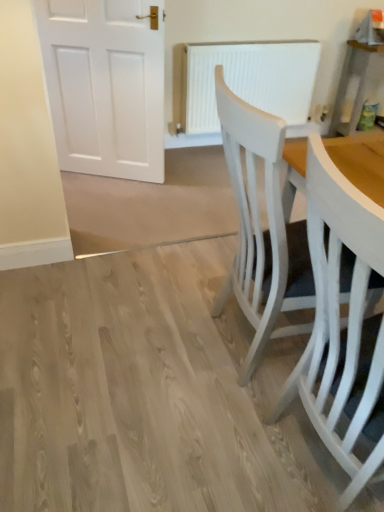
Where is `vacant space in white painted wood chair at right, which ranks as the second chair in front-to-back order (from a real-world perspective)`? vacant space in white painted wood chair at right, which ranks as the second chair in front-to-back order (from a real-world perspective) is located at coordinates (265, 359).